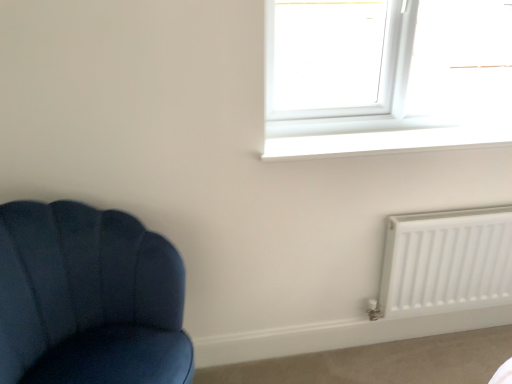
Question: Is white plastic window at upper right next to white matte radiator at lower right?

Choices:
 (A) yes
 (B) no

Answer: (B)

Question: Is white plastic window at upper right at the right side of white matte radiator at lower right?

Choices:
 (A) yes
 (B) no

Answer: (B)

Question: From a real-world perspective, is white plastic window at upper right located beneath white matte radiator at lower right?

Choices:
 (A) no
 (B) yes

Answer: (A)

Question: Is white plastic window at upper right positioned in front of white matte radiator at lower right?

Choices:
 (A) yes
 (B) no

Answer: (A)

Question: Does white plastic window at upper right contain white matte radiator at lower right?

Choices:
 (A) yes
 (B) no

Answer: (B)

Question: Considering the relative positions of white plastic window at upper right and white matte radiator at lower right in the image provided, is white plastic window at upper right to the left of white matte radiator at lower right from the viewer's perspective?

Choices:
 (A) no
 (B) yes

Answer: (B)

Question: Can you confirm if velvet blue chair at left is positioned to the left of white plastic window at upper right?

Choices:
 (A) no
 (B) yes

Answer: (B)

Question: Does velvet blue chair at left have a lesser width compared to white plastic window at upper right?

Choices:
 (A) no
 (B) yes

Answer: (A)

Question: Could you tell me if velvet blue chair at left is turned towards white plastic window at upper right?

Choices:
 (A) no
 (B) yes

Answer: (A)

Question: Is velvet blue chair at left further to the viewer compared to white plastic window at upper right?

Choices:
 (A) no
 (B) yes

Answer: (A)

Question: Does velvet blue chair at left have a smaller size compared to white plastic window at upper right?

Choices:
 (A) no
 (B) yes

Answer: (A)

Question: Is velvet blue chair at left positioned before white plastic window at upper right?

Choices:
 (A) yes
 (B) no

Answer: (A)

Question: Is white plastic window at upper right positioned behind velvet blue chair at left?

Choices:
 (A) yes
 (B) no

Answer: (A)